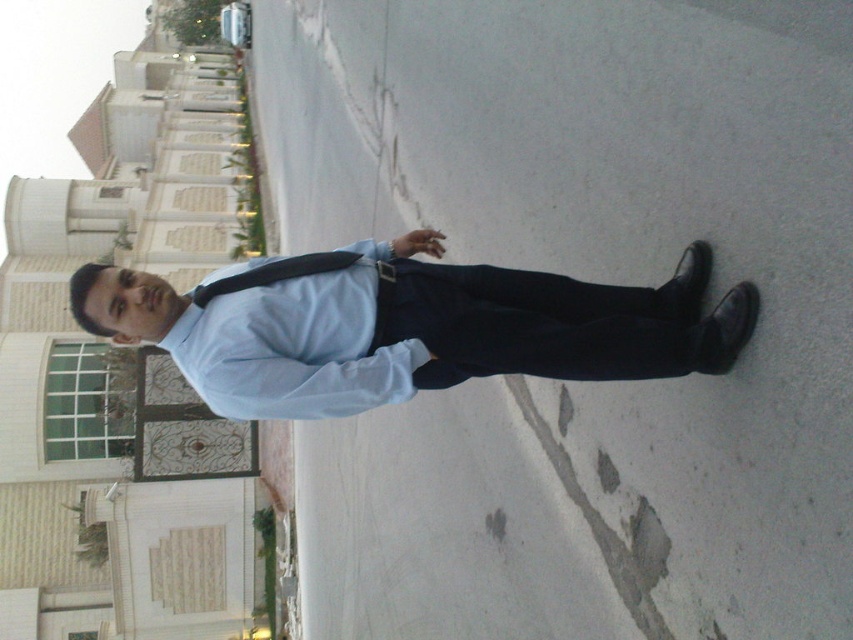
Question: Where is matte blue shirt at center located in relation to light blue cotton dress shirt at center in the image?

Choices:
 (A) left
 (B) right

Answer: (B)

Question: Which point is closer to the camera?

Choices:
 (A) (590, 308)
 (B) (184, 364)
 (C) (224, 413)

Answer: (A)

Question: Can you confirm if matte blue shirt at center is positioned above dark blue fabric pants at center?

Choices:
 (A) yes
 (B) no

Answer: (A)

Question: Can you confirm if matte blue shirt at center is positioned above dark blue fabric pants at center?

Choices:
 (A) yes
 (B) no

Answer: (A)

Question: Which point is closer to the camera?

Choices:
 (A) matte blue shirt at center
 (B) dark blue fabric pants at center
 (C) light blue cotton dress shirt at center

Answer: (A)

Question: Which of the following is the closest to the observer?

Choices:
 (A) matte blue shirt at center
 (B) light blue cotton dress shirt at center
 (C) dark blue fabric pants at center

Answer: (A)